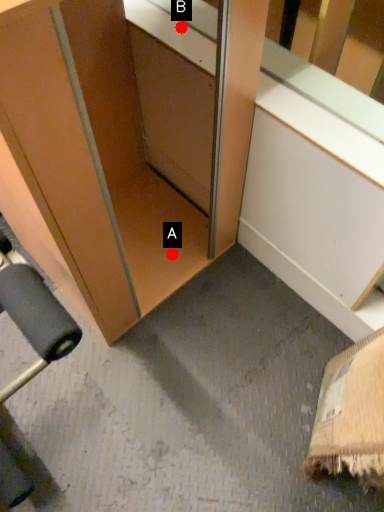
Question: Two points are circled on the image, labeled by A and B beside each circle. Which point is closer to the camera?

Choices:
 (A) A is closer
 (B) B is closer

Answer: (B)